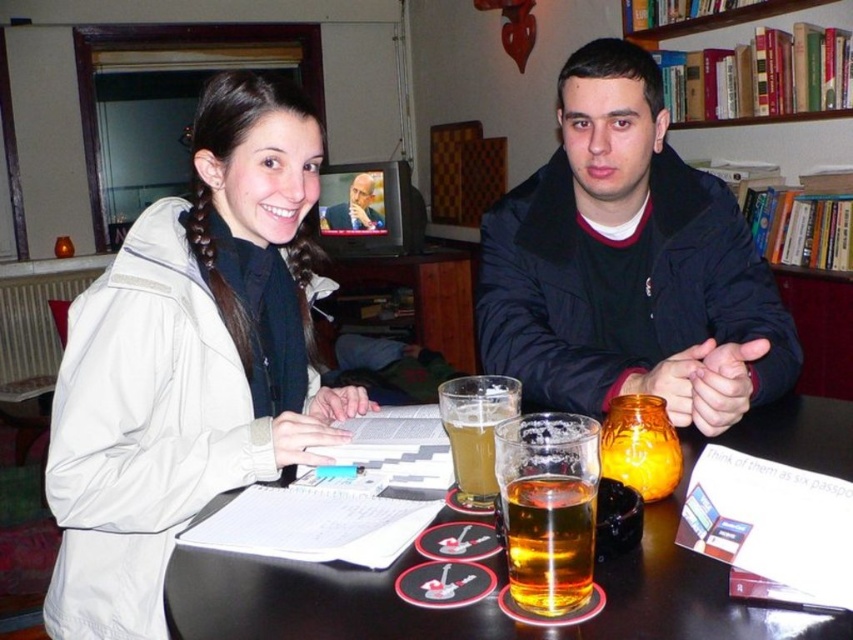
You are sitting at the table and want to reach for the dark blue jacket at center and the black plastic table at center. Which object is closer to you?

The dark blue jacket at center is closer to you because it is positioned further to the viewer than the black plastic table at center.

You are a person trying to place a new item on the table. Given the dark blue jacket at center and the black plastic table at center, which object is larger in size?

The dark blue jacket at center is bigger than the black plastic table at center, so the dark blue jacket at center is larger in size.

You are a photographer taking a portrait of the dark blue jacket at center and the smooth skin face at center. To ensure both subjects are in frame, should you adjust your camera to the left or right?

The dark blue jacket at center is to the right of the smooth skin face at center, so you should adjust your camera to the left to include both subjects in the frame.